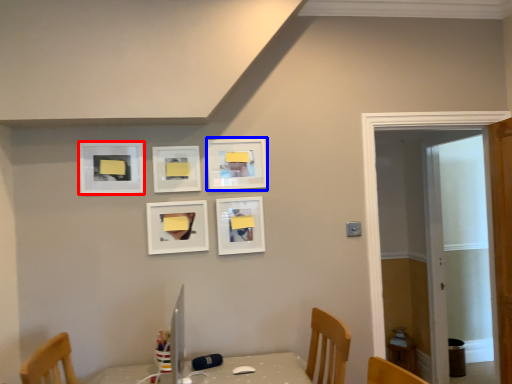
Question: Among these objects, which one is farthest to the camera, picture frame (highlighted by a red box) or picture frame (highlighted by a blue box)?

Choices:
 (A) picture frame
 (B) picture frame

Answer: (B)